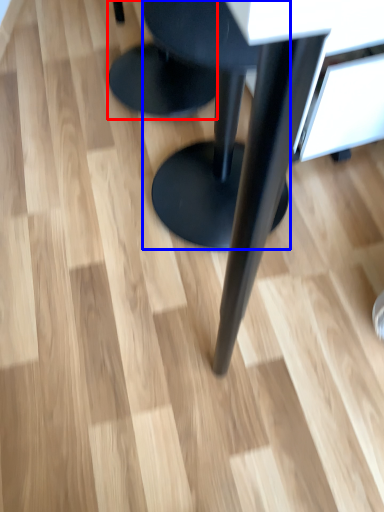
Question: Among these objects, which one is farthest to the camera, stool (highlighted by a red box) or stool (highlighted by a blue box)?

Choices:
 (A) stool
 (B) stool

Answer: (A)